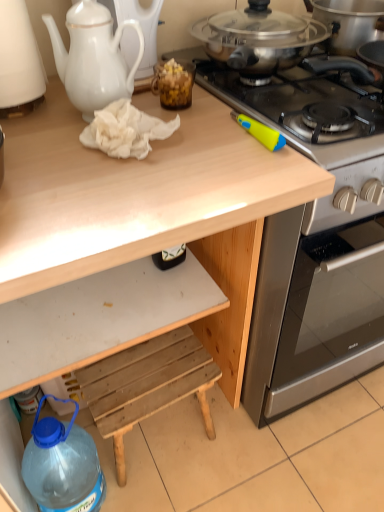
This screenshot has height=512, width=384. I want to click on blank space situated above white matte drawer at lower center (from a real-world perspective), so click(99, 312).